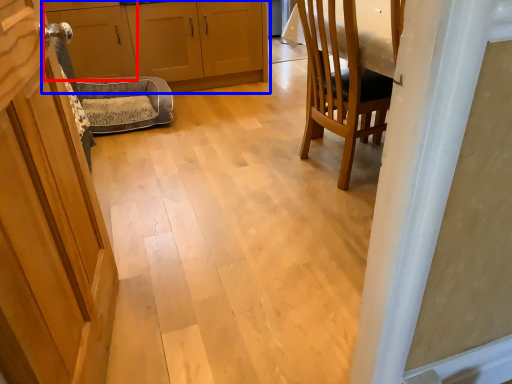
Question: Which object appears farthest to the camera in this image, cabinetry (highlighted by a red box) or cabinetry (highlighted by a blue box)?

Choices:
 (A) cabinetry
 (B) cabinetry

Answer: (B)